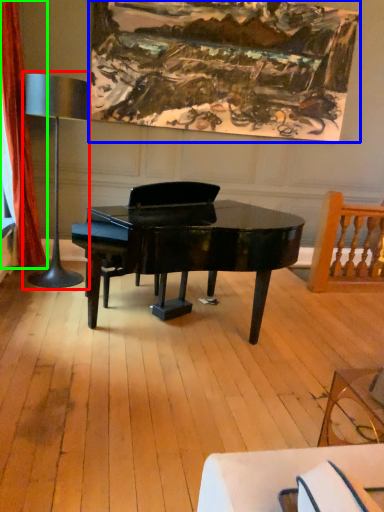
Question: Based on their relative distances, which object is nearer to table lamp (highlighted by a red box)? Choose from picture frame (highlighted by a blue box) and curtain (highlighted by a green box).

Choices:
 (A) picture frame
 (B) curtain

Answer: (B)